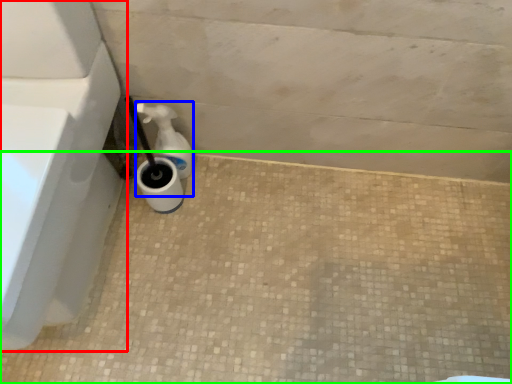
Question: Which object is the closest to the bath (highlighted by a red box)? Choose among these: soap dispenser (highlighted by a blue box) or concrete (highlighted by a green box).

Choices:
 (A) soap dispenser
 (B) concrete

Answer: (A)